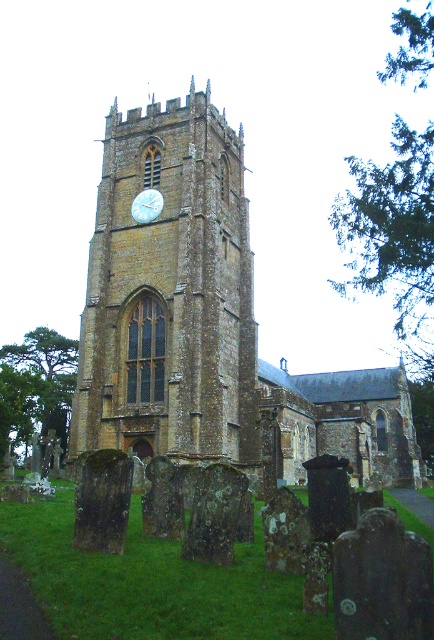
Question: Which point is closer to the camera?

Choices:
 (A) brown stone clock tower at center
 (B) white glossy clock at upper center

Answer: (A)

Question: Can you confirm if brown stone clock tower at center is smaller than white glossy clock at upper center?

Choices:
 (A) yes
 (B) no

Answer: (B)

Question: Is brown stone clock tower at center positioned at the back of white glossy clock at upper center?

Choices:
 (A) yes
 (B) no

Answer: (B)

Question: Which point is farther from the camera taking this photo?

Choices:
 (A) (142, 205)
 (B) (75, 410)

Answer: (A)

Question: Which point is farther to the camera?

Choices:
 (A) white glossy clock at upper center
 (B) brown stone clock tower at center

Answer: (A)

Question: Is the position of brown stone clock tower at center more distant than that of white glossy clock at upper center?

Choices:
 (A) no
 (B) yes

Answer: (A)